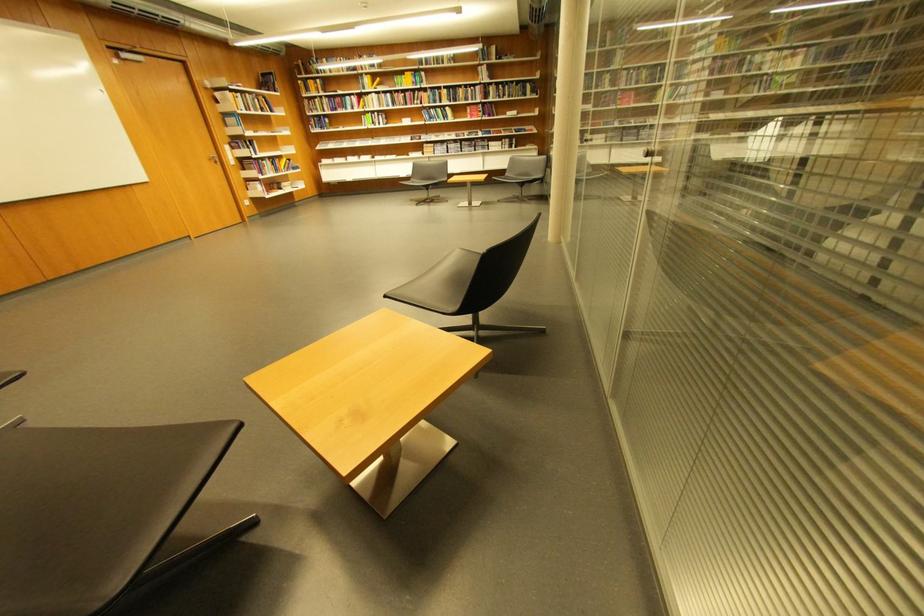
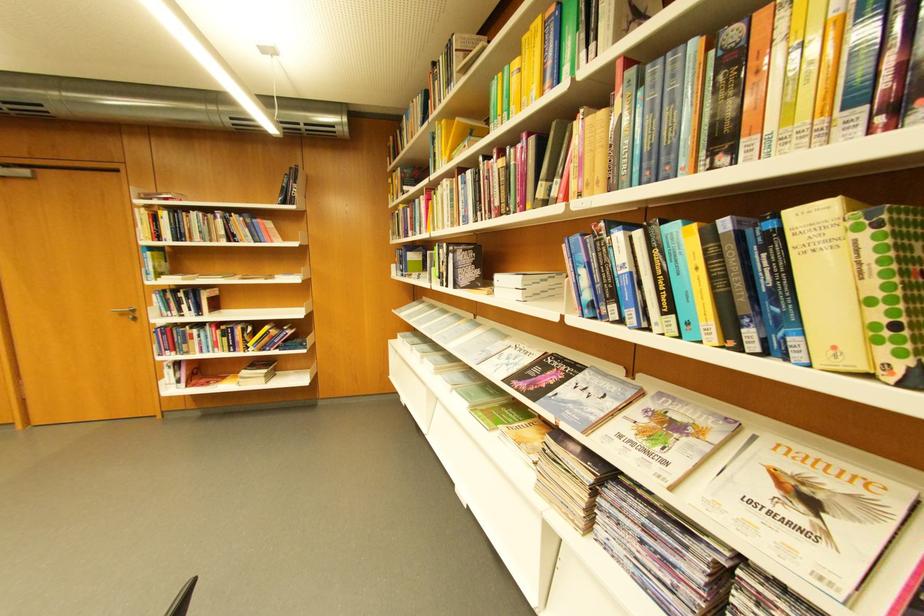
In the second image, find the point that corresponds to pixel 450 120 in the first image.

(681, 310)